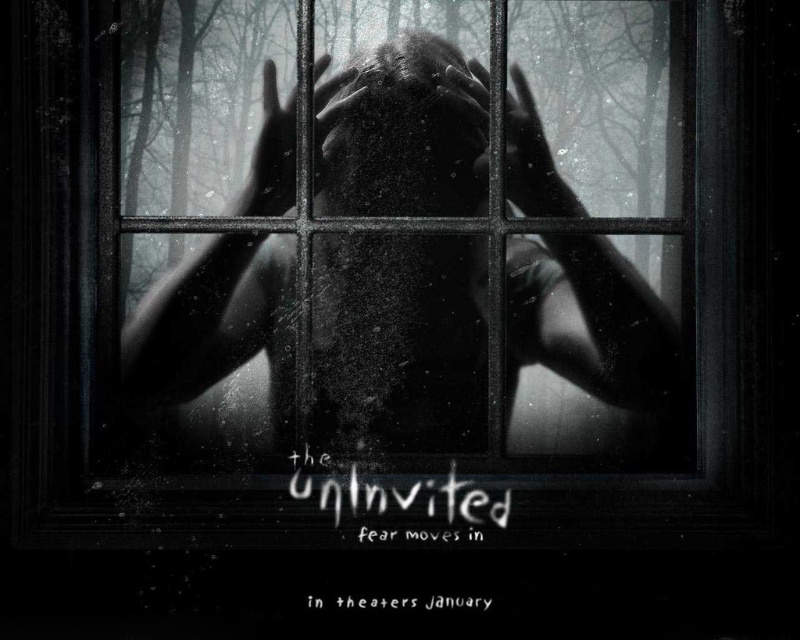
Question: Based on their relative distances, which object is nearer to the translucent flesh at center?

Choices:
 (A) smooth skin face at center
 (B) black matte hand at center

Answer: (A)

Question: Is translucent flesh at center further to camera compared to smooth skin hand at center?

Choices:
 (A) yes
 (B) no

Answer: (B)

Question: Considering the relative positions of black matte hand at center and smooth skin hand at center in the image provided, where is black matte hand at center located with respect to smooth skin hand at center?

Choices:
 (A) right
 (B) left

Answer: (A)

Question: Which of the following is the closest to the observer?

Choices:
 (A) smooth skin hand at center
 (B) translucent flesh at center

Answer: (B)

Question: Is translucent flesh at center to the left of black matte hand at center from the viewer's perspective?

Choices:
 (A) yes
 (B) no

Answer: (A)

Question: Which point appears farthest from the camera in this image?

Choices:
 (A) (206, 378)
 (B) (484, 161)

Answer: (B)